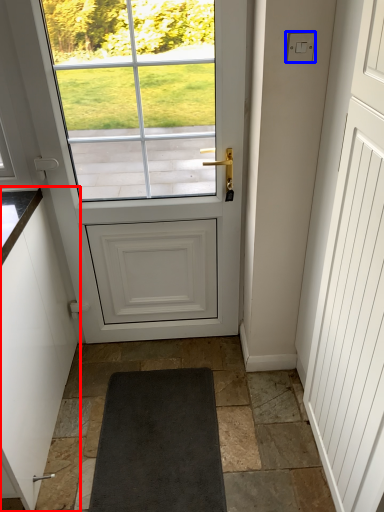
Question: Which object is closer to the camera taking this photo, cabinetry (highlighted by a red box) or lock (highlighted by a blue box)?

Choices:
 (A) cabinetry
 (B) lock

Answer: (A)